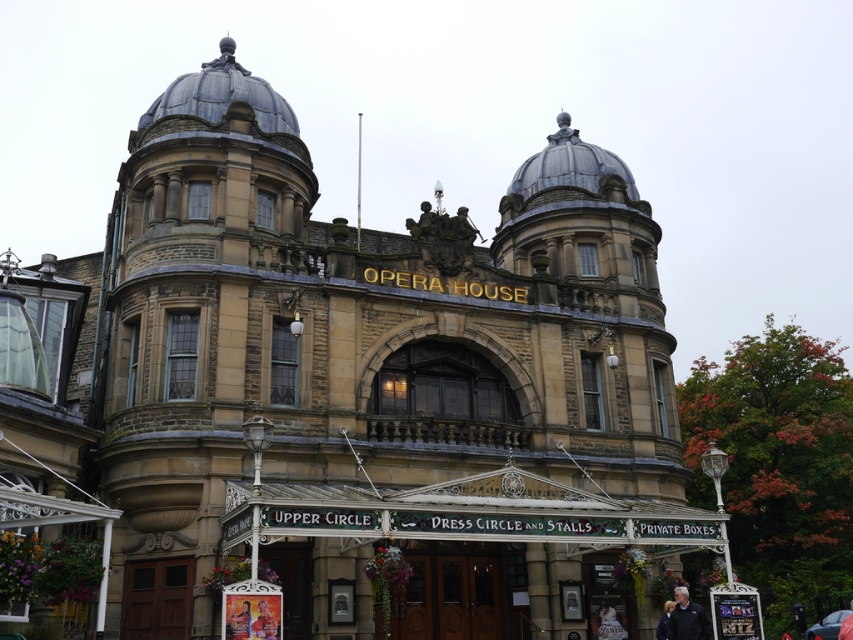
Does black fabric at lower right have a lesser height compared to dark blue jacket at lower right?

No.

Is black fabric at lower right wider than dark blue jacket at lower right?

Yes, black fabric at lower right is wider than dark blue jacket at lower right.

Who is more forward, (x=695, y=632) or (x=664, y=605)?

Positioned in front is point (x=695, y=632).

Find the location of a particular element. black fabric at lower right is located at coordinates (688, 618).

Does matte red dress at center have a lesser height compared to white cotton shirt at lower right?

Yes, matte red dress at center is shorter than white cotton shirt at lower right.

Locate an element on the screen. The image size is (853, 640). matte red dress at center is located at coordinates (264, 621).

Between point (273, 596) and point (604, 632), which one is positioned in front?

Point (273, 596) is more forward.

At what (x,y) coordinates should I click in order to perform the action: click on matte red dress at center. Please return your answer as a coordinate pair (x, y). Looking at the image, I should click on (264, 621).

Is matte red dress at center positioned behind dark blue jacket at lower right?

No, matte red dress at center is in front of dark blue jacket at lower right.

Which is above, matte red dress at center or dark blue jacket at lower right?

matte red dress at center

Is point (263, 608) less distant than point (660, 618)?

Yes, point (263, 608) is closer to viewer.

Where is `matte red dress at center`? This screenshot has width=853, height=640. matte red dress at center is located at coordinates (264, 621).